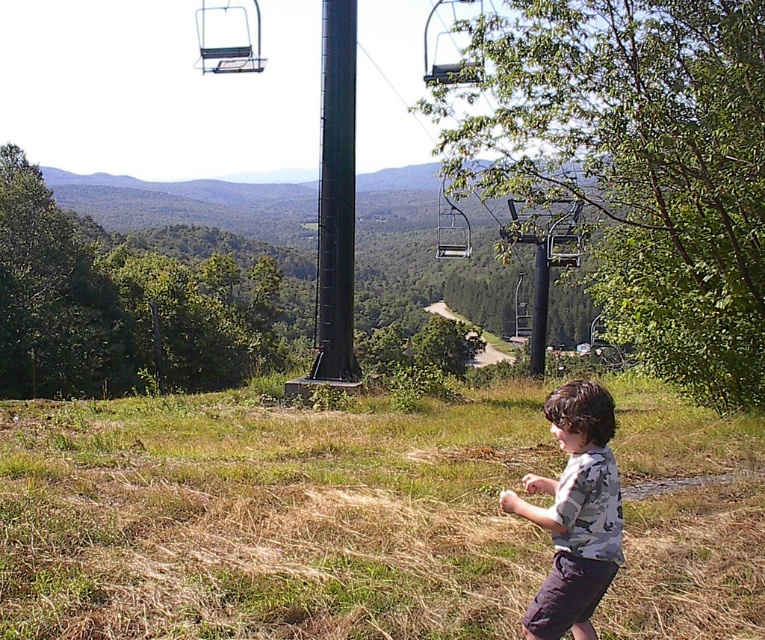
Is point (321, 147) positioned before point (467, 250)?

Yes.

The height and width of the screenshot is (640, 765). What do you see at coordinates (334, 196) in the screenshot?
I see `black matte pole at center` at bounding box center [334, 196].

Image resolution: width=765 pixels, height=640 pixels. In order to click on black matte pole at center in this screenshot , I will do `click(334, 196)`.

Can you confirm if camouflage shirt at lower right is positioned to the left of metallic silver ski lift at center?

Indeed, camouflage shirt at lower right is positioned on the left side of metallic silver ski lift at center.

The image size is (765, 640). What do you see at coordinates (575, 513) in the screenshot?
I see `camouflage shirt at lower right` at bounding box center [575, 513].

Is point (601, 454) positioned after point (454, 253)?

No, (601, 454) is in front of (454, 253).

The height and width of the screenshot is (640, 765). I want to click on camouflage shirt at lower right, so click(575, 513).

Is metallic blue chairlift at upper center smaller than metallic pole at center?

Incorrect, metallic blue chairlift at upper center is not smaller in size than metallic pole at center.

Does metallic blue chairlift at upper center appear under metallic pole at center?

No, metallic blue chairlift at upper center is not below metallic pole at center.

Is point (213, 33) positioned after point (532, 312)?

Yes.

At what (x,y) coordinates should I click in order to perform the action: click on metallic blue chairlift at upper center. Please return your answer as a coordinate pair (x, y). Looking at the image, I should click on (228, 38).